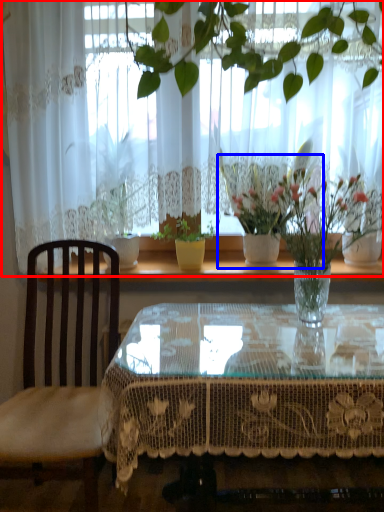
Question: Among these objects, which one is farthest to the camera, curtain (highlighted by a red box) or houseplant (highlighted by a blue box)?

Choices:
 (A) curtain
 (B) houseplant

Answer: (B)